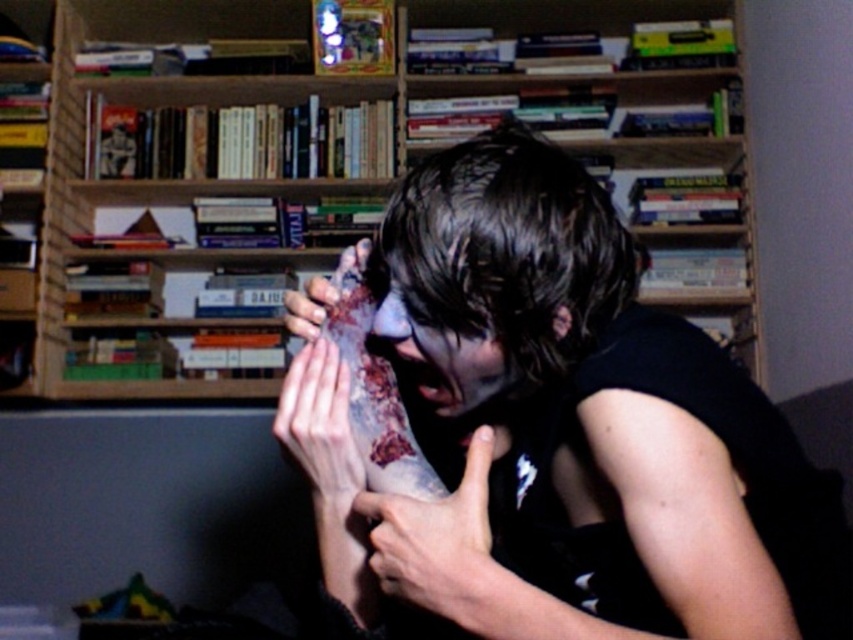
Can you confirm if wooden bookshelf at upper center is shorter than dark skin tattooed arm at center?

Incorrect, wooden bookshelf at upper center's height does not fall short of dark skin tattooed arm at center's.

Looking at this image, which is below, wooden bookshelf at upper center or dark skin tattooed arm at center?

dark skin tattooed arm at center is below.

What do you see at coordinates (300, 157) in the screenshot? The height and width of the screenshot is (640, 853). I see `wooden bookshelf at upper center` at bounding box center [300, 157].

Locate an element on the screen. wooden bookshelf at upper center is located at coordinates (300, 157).

Between dark matte skin at center and smooth skin hand at center, which one has more height?

dark matte skin at center

Is the position of dark matte skin at center less distant than that of smooth skin hand at center?

Yes, it is in front of smooth skin hand at center.

The image size is (853, 640). What are the coordinates of `dark matte skin at center` in the screenshot? It's located at pyautogui.click(x=561, y=435).

At what (x,y) coordinates should I click in order to perform the action: click on dark matte skin at center. Please return your answer as a coordinate pair (x, y). Looking at the image, I should click on (561, 435).

Which of these two, dark matte skin at center or wooden bookshelf at upper center, stands shorter?

dark matte skin at center is shorter.

Identify the location of dark matte skin at center. The image size is (853, 640). (561, 435).

Locate an element on the screen. dark matte skin at center is located at coordinates (561, 435).